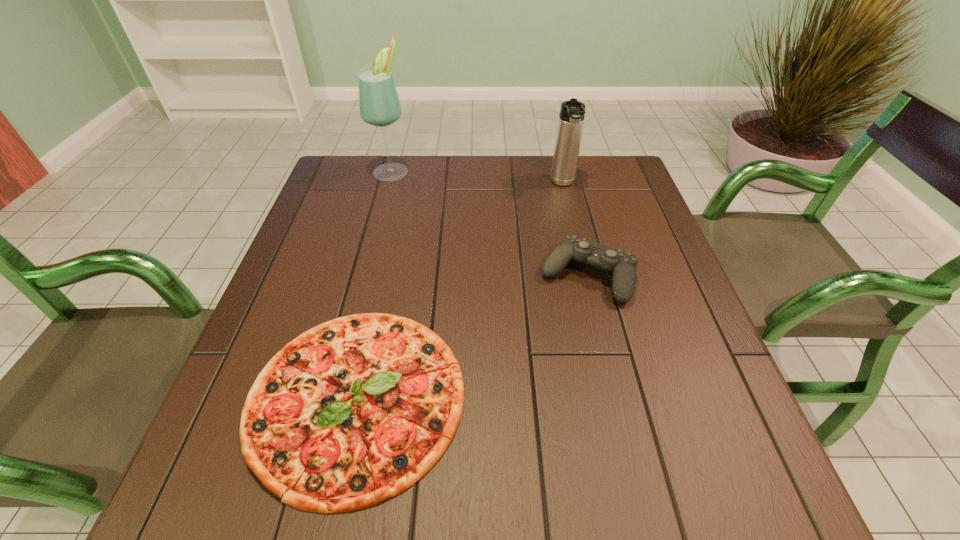
At what (x,y) coordinates should I click in order to perform the action: click on alcohol that is at the far edge. Please return your answer as a coordinate pair (x, y). The height and width of the screenshot is (540, 960). Looking at the image, I should click on (379, 105).

The image size is (960, 540). I want to click on thermos bottle that is at the far edge, so click(571, 117).

At what (x,y) coordinates should I click in order to perform the action: click on object present at the near edge. Please return your answer as a coordinate pair (x, y). Image resolution: width=960 pixels, height=540 pixels. Looking at the image, I should click on (352, 412).

Image resolution: width=960 pixels, height=540 pixels. I want to click on alcohol present at the left edge, so click(379, 105).

Find the location of a particular element. pizza that is at the left edge is located at coordinates (352, 412).

This screenshot has width=960, height=540. Identify the location of object situated at the right edge. (622, 265).

Locate an element on the screen. The width and height of the screenshot is (960, 540). object that is at the far left corner is located at coordinates (379, 105).

Locate an element on the screen. This screenshot has width=960, height=540. object that is at the near left corner is located at coordinates (352, 412).

The width and height of the screenshot is (960, 540). What are the coordinates of `vacant space at the far edge` in the screenshot? It's located at (399, 182).

This screenshot has height=540, width=960. I want to click on vacant space at the near edge of the desktop, so click(509, 463).